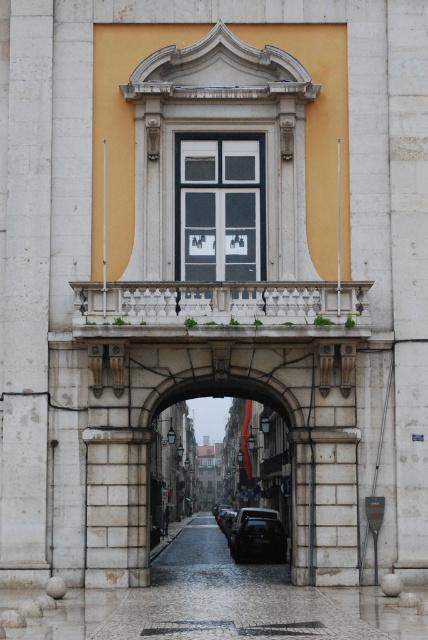
Who is more distant from viewer, [211,184] or [255,460]?

The point [255,460] is more distant.

Identify the location of matte glass window at center. (219, 205).

Which is behind, point (163, 448) or point (243, 545)?

The point (163, 448) is more distant.

Can you confirm if stone archway at center is positioned below shiny black car at center?

No.

This screenshot has width=428, height=640. What are the coordinates of `stone archway at center` in the screenshot? It's located at (225, 464).

The width and height of the screenshot is (428, 640). In order to click on stone archway at center in this screenshot , I will do [225, 464].

Who is positioned more to the left, matte glass window at center or shiny black car at center?

matte glass window at center is more to the left.

Does point (181, 182) come closer to viewer compared to point (261, 557)?

That is True.

What are the coordinates of `matte glass window at center` in the screenshot? It's located at (219, 205).

At what (x,y) coordinates should I click in order to perform the action: click on matte glass window at center. Please return your answer as a coordinate pair (x, y). The width and height of the screenshot is (428, 640). Looking at the image, I should click on (219, 205).